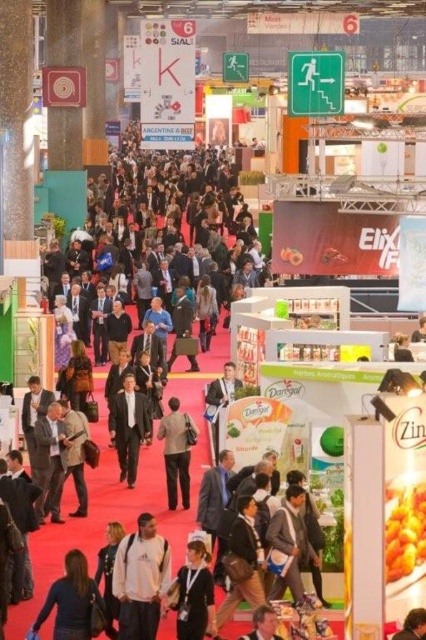
Which is below, white cotton jacket at center or dark brown leather jacket at lower left?

dark brown leather jacket at lower left

Between white cotton jacket at center and dark brown leather jacket at lower left, which one appears on the left side from the viewer's perspective?

Positioned to the left is dark brown leather jacket at lower left.

Between point (158, 586) and point (39, 625), which one is positioned behind?

Point (158, 586)

Where is `white cotton jacket at center`? The height and width of the screenshot is (640, 426). white cotton jacket at center is located at coordinates (141, 579).

Does dark suit at center appear on the right side of light brown leather jacket at center?

In fact, dark suit at center is to the left of light brown leather jacket at center.

Is dark suit at center further to camera compared to light brown leather jacket at center?

That is True.

Which is in front, point (132, 396) or point (184, 474)?

Point (184, 474) is more forward.

Find the location of a particular element. dark suit at center is located at coordinates (129, 428).

Which is more to the right, white cotton jacket at center or dark suit at center?

From the viewer's perspective, white cotton jacket at center appears more on the right side.

Can you confirm if white cotton jacket at center is taller than dark suit at center?

Yes, white cotton jacket at center is taller than dark suit at center.

Which is behind, point (131, 636) or point (129, 432)?

The point (129, 432) is behind.

Where is `white cotton jacket at center`? The width and height of the screenshot is (426, 640). white cotton jacket at center is located at coordinates (141, 579).